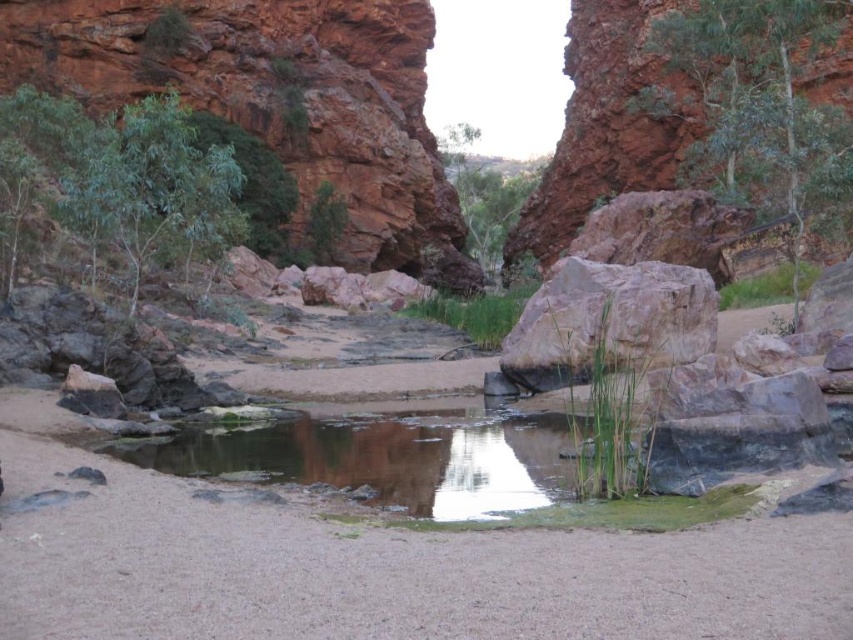
Does rustic sandstone cliff at upper left have a smaller size compared to smooth beige rock at center?

Incorrect, rustic sandstone cliff at upper left is not smaller in size than smooth beige rock at center.

Who is more distant from viewer, (219, 60) or (613, 262)?

The point (219, 60) is behind.

Locate an element on the screen. Image resolution: width=853 pixels, height=640 pixels. rustic sandstone cliff at upper left is located at coordinates (277, 99).